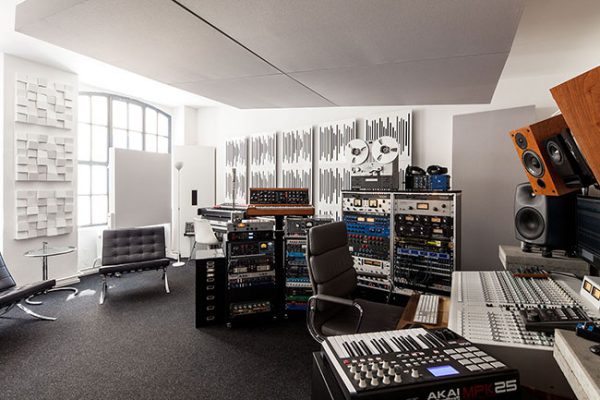
This screenshot has width=600, height=400. In order to click on small white chair in this screenshot , I will do [x=208, y=237].